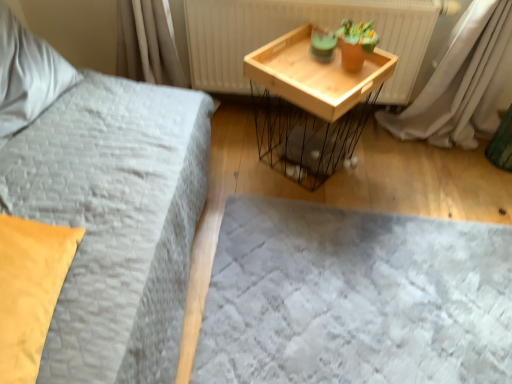
Question: Is wooden tray at upper right closer to the viewer compared to soft gray fabric bed frame at lower center?

Choices:
 (A) no
 (B) yes

Answer: (A)

Question: Could you tell me if wooden tray at upper right is turned towards soft gray fabric bed frame at lower center?

Choices:
 (A) no
 (B) yes

Answer: (B)

Question: Is wooden tray at upper right thinner than soft gray fabric bed frame at lower center?

Choices:
 (A) yes
 (B) no

Answer: (A)

Question: From the image's perspective, is wooden tray at upper right on top of soft gray fabric bed frame at lower center?

Choices:
 (A) no
 (B) yes

Answer: (B)

Question: Considering the relative sizes of wooden tray at upper right and soft gray fabric bed frame at lower center in the image provided, is wooden tray at upper right bigger than soft gray fabric bed frame at lower center?

Choices:
 (A) no
 (B) yes

Answer: (B)

Question: Is soft gray fabric bed frame at lower center taller or shorter than soft white pillow at upper left, the 1th pillow from the left?

Choices:
 (A) short
 (B) tall

Answer: (A)

Question: Looking at their shapes, would you say soft gray fabric bed frame at lower center is wider or thinner than soft white pillow at upper left, the second pillow from the front?

Choices:
 (A) thin
 (B) wide

Answer: (B)

Question: Based on their sizes in the image, would you say soft gray fabric bed frame at lower center is bigger or smaller than soft white pillow at upper left, the first pillow when ordered from top to bottom?

Choices:
 (A) small
 (B) big

Answer: (A)

Question: From the image's perspective, is soft gray fabric bed frame at lower center positioned above or below soft white pillow at upper left, the first pillow when ordered from top to bottom?

Choices:
 (A) below
 (B) above

Answer: (A)

Question: From a real-world perspective, is matte yellow pillow at left, which is counted as the second pillow, starting from the left, above or below soft gray fabric bed frame at lower center?

Choices:
 (A) above
 (B) below

Answer: (A)

Question: From the image's perspective, is matte yellow pillow at left, positioned as the first pillow in front-to-back order, positioned above or below soft gray fabric bed frame at lower center?

Choices:
 (A) above
 (B) below

Answer: (A)

Question: Is matte yellow pillow at left, which is counted as the first pillow, starting from the bottom, to the left or to the right of soft gray fabric bed frame at lower center in the image?

Choices:
 (A) left
 (B) right

Answer: (A)

Question: Relative to soft gray fabric bed frame at lower center, is matte yellow pillow at left, placed as the 2th pillow when sorted from top to bottom, in front or behind?

Choices:
 (A) front
 (B) behind

Answer: (A)

Question: From a real-world perspective, is matte yellow pillow at left, the 1th pillow viewed from the right, above or below wooden tray at upper right?

Choices:
 (A) above
 (B) below

Answer: (A)

Question: Is matte yellow pillow at left, which is counted as the first pillow, starting from the bottom, bigger or smaller than wooden tray at upper right?

Choices:
 (A) big
 (B) small

Answer: (B)